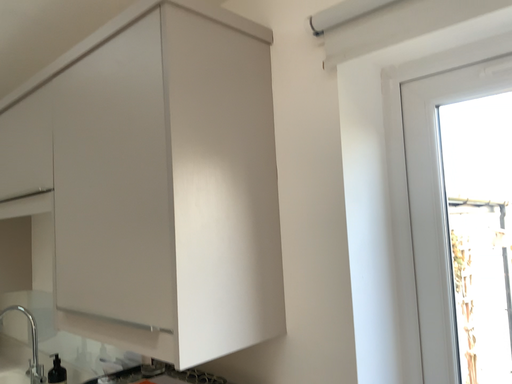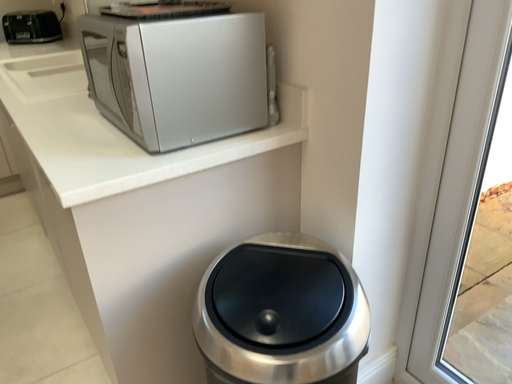
Question: How did the camera likely rotate when shooting the video?

Choices:
 (A) rotated downward
 (B) rotated upward

Answer: (A)